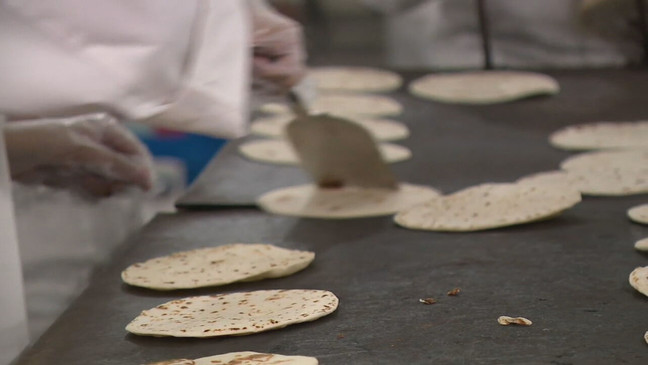
Where is `flat part of the spatula`? Image resolution: width=648 pixels, height=365 pixels. flat part of the spatula is located at coordinates (332, 135).